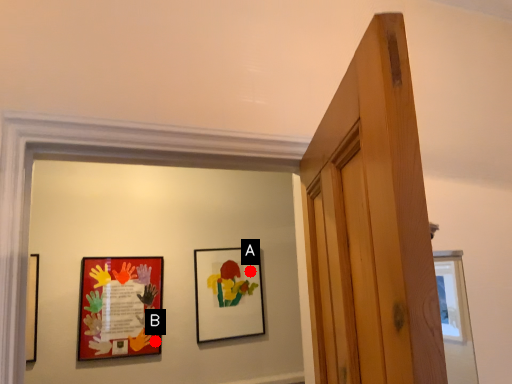
Question: Two points are circled on the image, labeled by A and B beside each circle. Which point appears closest to the camera in this image?

Choices:
 (A) A is closer
 (B) B is closer

Answer: (B)